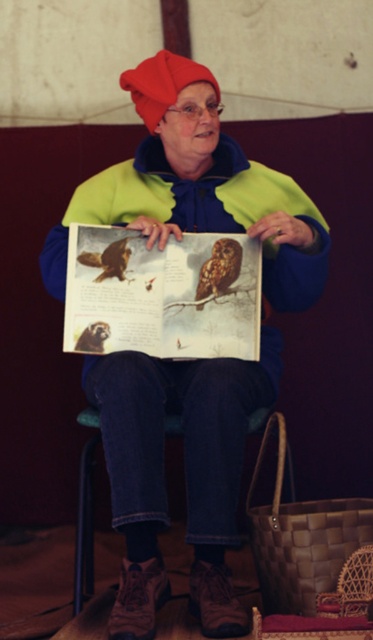
The height and width of the screenshot is (640, 373). In order to click on matte green jacket at center in this screenshot , I will do `click(185, 472)`.

Does matte green jacket at center appear under brown fuzzy owl at center?

Yes.

At what (x,y) coordinates should I click in order to perform the action: click on matte green jacket at center. Please return your answer as a coordinate pair (x, y). Image resolution: width=373 pixels, height=640 pixels. Looking at the image, I should click on (185, 472).

Is matte paper book at center shorter than brown fuzzy owl at center?

Incorrect, matte paper book at center's height does not fall short of brown fuzzy owl at center's.

Does matte paper book at center have a greater height compared to brown fuzzy owl at center?

Yes, matte paper book at center is taller than brown fuzzy owl at center.

Is point (230, 273) closer to viewer compared to point (205, 294)?

No, (230, 273) is further to viewer.

Where is `matte paper book at center`? Image resolution: width=373 pixels, height=640 pixels. matte paper book at center is located at coordinates (163, 294).

Based on the photo, between matte green jacket at center and matte paper book at center, which one appears on the left side from the viewer's perspective?

matte paper book at center is more to the left.

Is the position of matte green jacket at center more distant than that of matte paper book at center?

No, it is not.

Who is more forward, (x=284, y=253) or (x=246, y=349)?

Point (x=246, y=349) is in front.

At what (x,y) coordinates should I click in order to perform the action: click on matte green jacket at center. Please return your answer as a coordinate pair (x, y). This screenshot has width=373, height=640. Looking at the image, I should click on (185, 472).